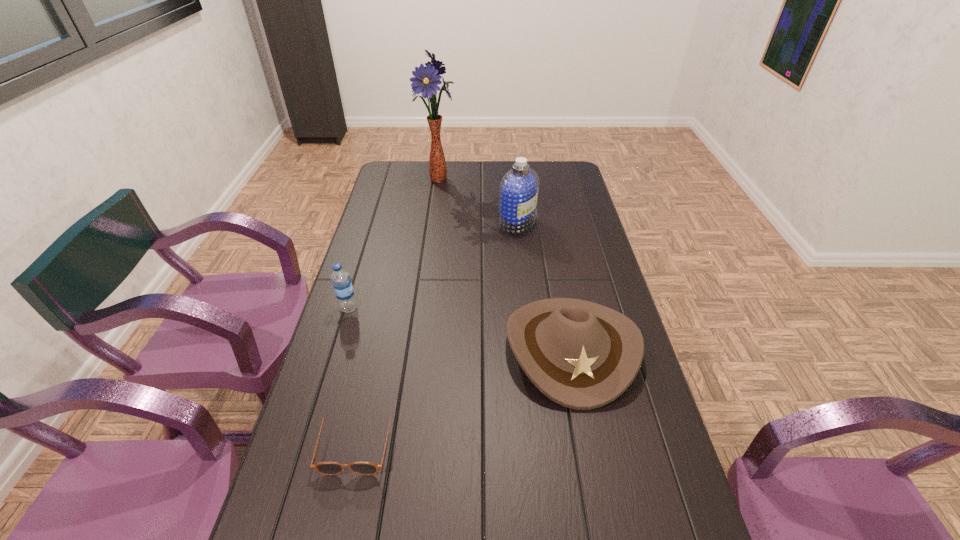
You are a GUI agent. You are given a task and a screenshot of the screen. Output one action in this format:
    pyautogui.click(x=<x>, y=<y>)
    Task: Click on the free space located 0.230m on the left of the second tallest object
    
    Given the screenshot: What is the action you would take?
    pyautogui.click(x=438, y=222)

Find the location of `vacant area located on the label of the third tallest object`. vacant area located on the label of the third tallest object is located at coordinates (488, 308).

You are a GUI agent. You are given a task and a screenshot of the screen. Output one action in this format:
    pyautogui.click(x=<x>, y=<y>)
    Task: Click on the vacant space situated with a star on the front of the second shortest object
    
    Given the screenshot: What is the action you would take?
    pyautogui.click(x=593, y=466)

Image resolution: width=960 pixels, height=540 pixels. What are the coordinates of `object located at the far edge` in the screenshot? It's located at (426, 80).

Where is `water bottle present at the left edge`? water bottle present at the left edge is located at coordinates (341, 280).

Identify the location of sunglasses at the left edge. The image size is (960, 540). (326, 468).

Where is `object that is at the right edge`? The image size is (960, 540). object that is at the right edge is located at coordinates (582, 355).

The image size is (960, 540). In the image, there is a desktop. In order to click on vacant space at the far edge in this screenshot , I will do `click(464, 172)`.

This screenshot has height=540, width=960. Find the location of `free region at the left edge of the desktop`. free region at the left edge of the desktop is located at coordinates (361, 240).

The width and height of the screenshot is (960, 540). Find the location of `free space at the right edge of the desktop`. free space at the right edge of the desktop is located at coordinates (588, 245).